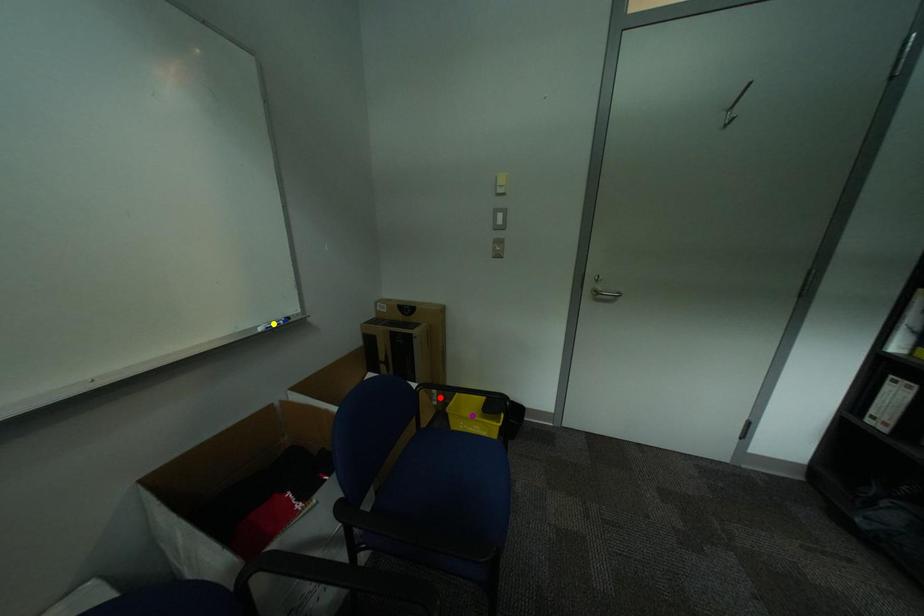
Order these from nearest to farthest:
- yellow point
- purple point
- red point

yellow point
purple point
red point